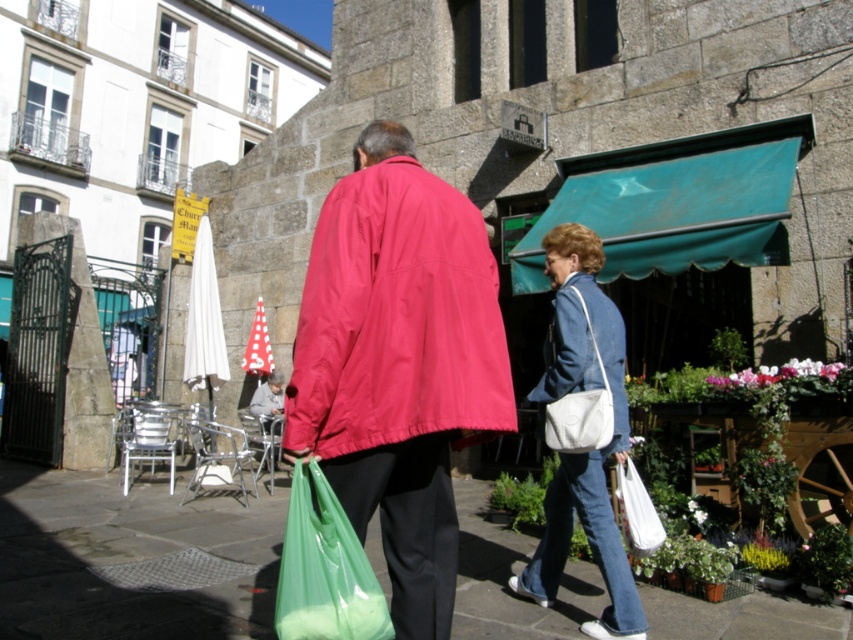
Is green plastic bag at center positioned before green plastic bag at lower center?

No, green plastic bag at center is further to the viewer.

Based on the photo, who is taller, green plastic bag at center or green plastic bag at lower center?

green plastic bag at lower center is taller.

At what (x,y) coordinates should I click in order to perform the action: click on green plastic bag at center. Please return your answer as a coordinate pair (x, y). This screenshot has width=853, height=640. Looking at the image, I should click on (132, 560).

At what (x,y) coordinates should I click in order to perform the action: click on green plastic bag at center. Please return your answer as a coordinate pair (x, y). Looking at the image, I should click on (132, 560).

Which of these two, green plastic bag at center or denim jacket at lower right, stands shorter?

green plastic bag at center

Based on the photo, does green plastic bag at center have a lesser height compared to denim jacket at lower right?

Correct, green plastic bag at center is not as tall as denim jacket at lower right.

Which is behind, point (178, 579) or point (599, 289)?

Point (178, 579)

Identify the location of green plastic bag at center. This screenshot has width=853, height=640. (132, 560).

Is point (463, 264) farther from viewer compared to point (583, 381)?

No, (463, 264) is in front of (583, 381).

From the picture: Is matte red jacket at center shorter than denim jacket at lower right?

Incorrect, matte red jacket at center's height does not fall short of denim jacket at lower right's.

Who is more forward, (378,292) or (592,312)?

Point (378,292)

This screenshot has width=853, height=640. In order to click on matte red jacket at center in this screenshot , I will do `click(398, 364)`.